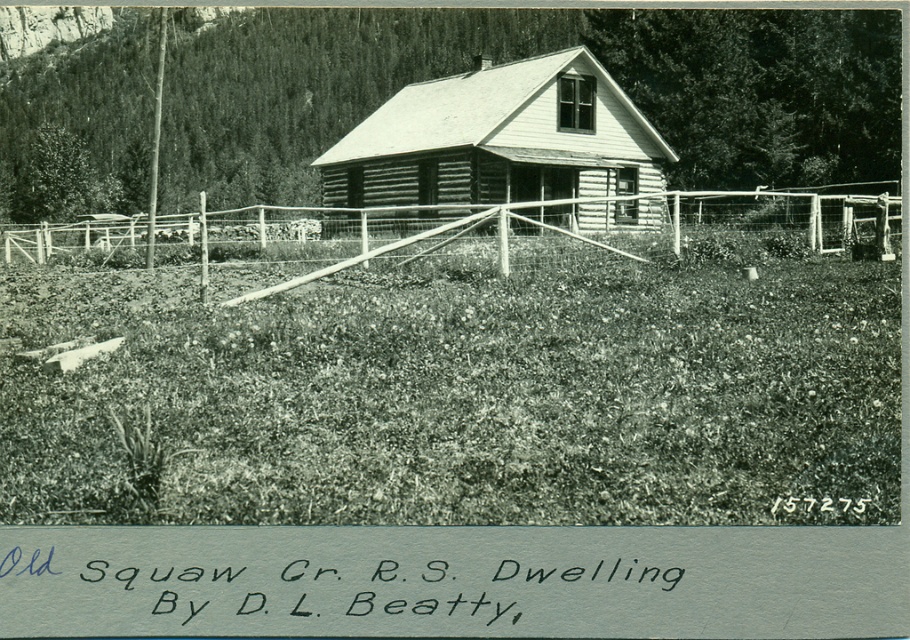
In the scene shown: Measure the distance from wooden fence at center to wooden cabin at center.

wooden fence at center and wooden cabin at center are 14.98 feet apart from each other.

What do you see at coordinates (534, 228) in the screenshot? I see `wooden fence at center` at bounding box center [534, 228].

This screenshot has width=910, height=640. Describe the element at coordinates (534, 228) in the screenshot. I see `wooden fence at center` at that location.

Identify the location of wooden fence at center. The width and height of the screenshot is (910, 640). (534, 228).

Who is lower down, grassy at center or wooden cabin at center?

grassy at center

Does grassy at center have a lesser width compared to wooden cabin at center?

Yes, grassy at center is thinner than wooden cabin at center.

Is point (506, 362) positioned before point (483, 156)?

Yes, it is in front of point (483, 156).

The image size is (910, 640). Identify the location of grassy at center. coord(464,396).

Which is more to the right, grassy at center or wooden fence at center?

From the viewer's perspective, grassy at center appears more on the right side.

Is grassy at center behind wooden fence at center?

No, it is in front of wooden fence at center.

Is point (329, 324) positioned in front of point (77, 248)?

Yes.

Identify the location of grassy at center. The width and height of the screenshot is (910, 640). (464, 396).